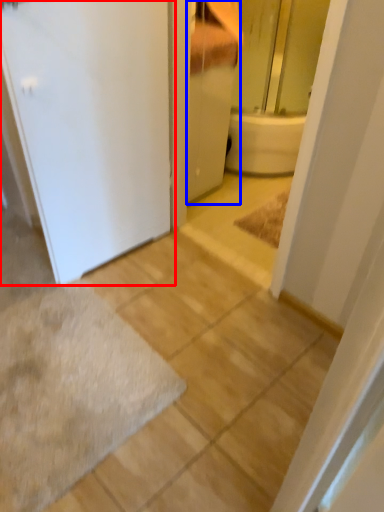
Question: Among these objects, which one is nearest to the camera, door (highlighted by a red box) or bathroom cabinet (highlighted by a blue box)?

Choices:
 (A) door
 (B) bathroom cabinet

Answer: (A)